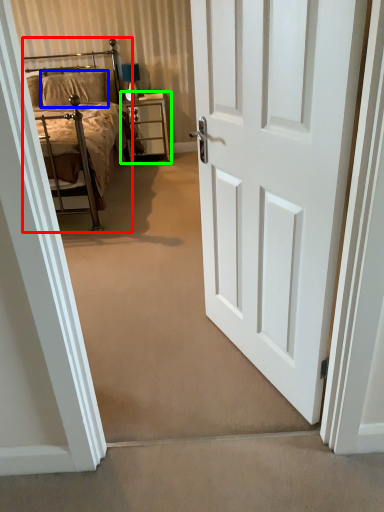
Question: Considering the real-world distances, which object is farthest from bed (highlighted by a red box)? pillow (highlighted by a blue box) or nightstand (highlighted by a green box)?

Choices:
 (A) pillow
 (B) nightstand

Answer: (A)